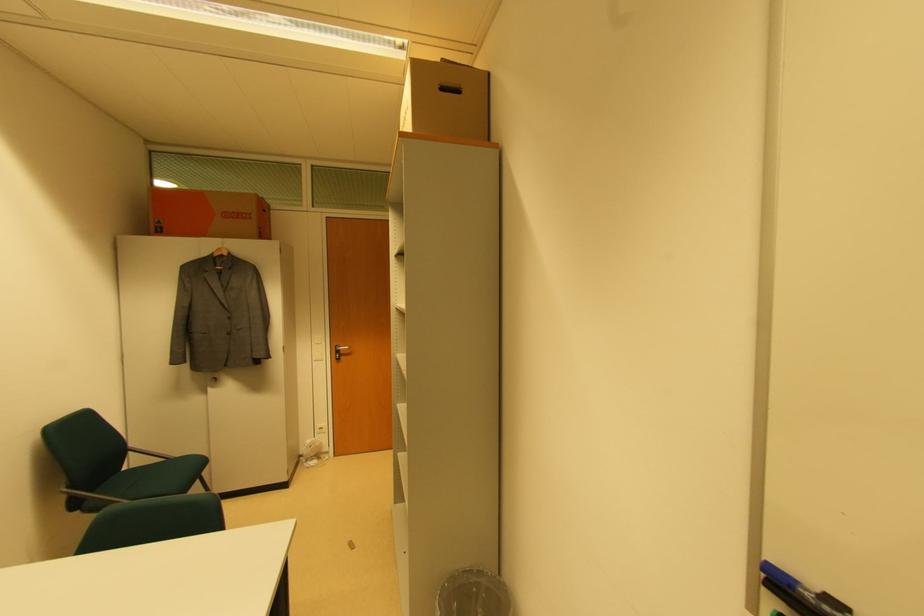
This screenshot has height=616, width=924. Describe the element at coordinates (214, 379) in the screenshot. I see `the round cabinet handle` at that location.